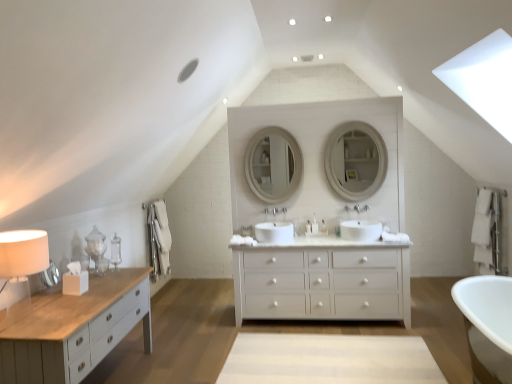
I want to click on free space above white glossy mirror at center, the first mirror in the left-to-right sequence (from a real-world perspective), so click(274, 122).